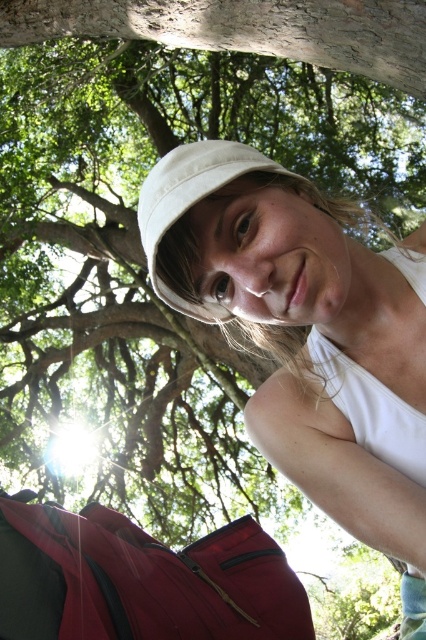
You are a photographer trying to capture a clear shot of both the white matte hat at center and the white cotton hat at center in the scene. Given that your camera has a minimum focus distance of 5 inches, will you be able to focus on both hats simultaneously?

The white matte hat at center and white cotton hat at center are 4.89 inches apart, which is less than the camera minimum focus distance of 5 inches. Therefore, the camera cannot focus on both hats simultaneously.

You are a photographer trying to capture the best angle of the scene. You notice two points in the image labeled as point 1 at coordinates point (164, 234) and point 2 at coordinates point (157, 221). Which point is nearer to your camera lens?

Point (164, 234) is closer to the camera than point (157, 221), so the photographer should focus on point (164, 234) for a closer shot.